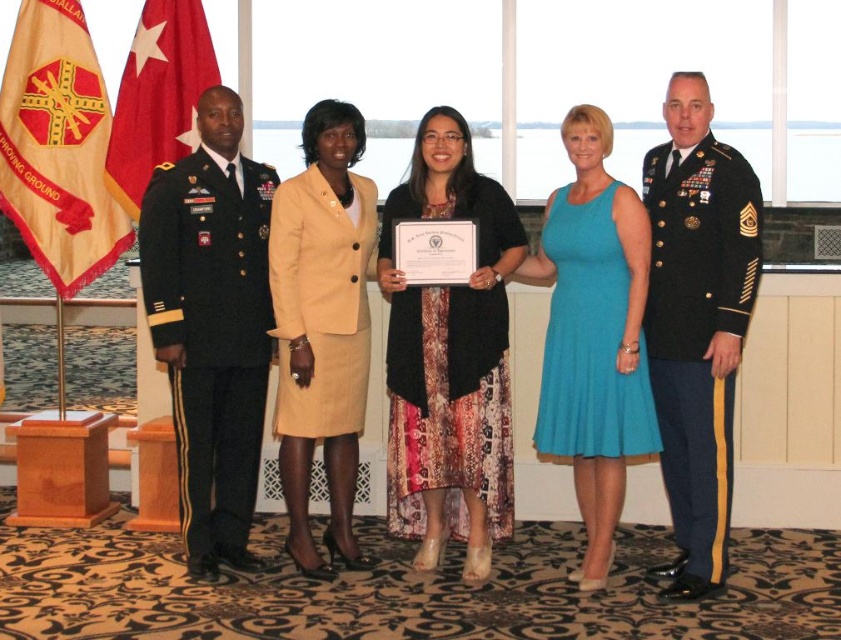
Which is in front, point (229, 429) or point (611, 241)?

Point (611, 241) is in front.

The height and width of the screenshot is (640, 841). I want to click on green military uniform at left, so click(x=210, y=333).

Locate an element on the screen. Image resolution: width=841 pixels, height=640 pixels. green military uniform at left is located at coordinates (210, 333).

I want to click on teal fabric dress at center, so click(594, 333).

Locate an element on the screen. This screenshot has height=640, width=841. teal fabric dress at center is located at coordinates (594, 333).

Does black matte dress at center appear on the left side of red flag at left?

No, black matte dress at center is not to the left of red flag at left.

Who is higher up, black matte dress at center or red flag at left?

red flag at left is above.

Where is `black matte dress at center`? The width and height of the screenshot is (841, 640). black matte dress at center is located at coordinates (448, 406).

The width and height of the screenshot is (841, 640). I want to click on black matte dress at center, so click(x=448, y=406).